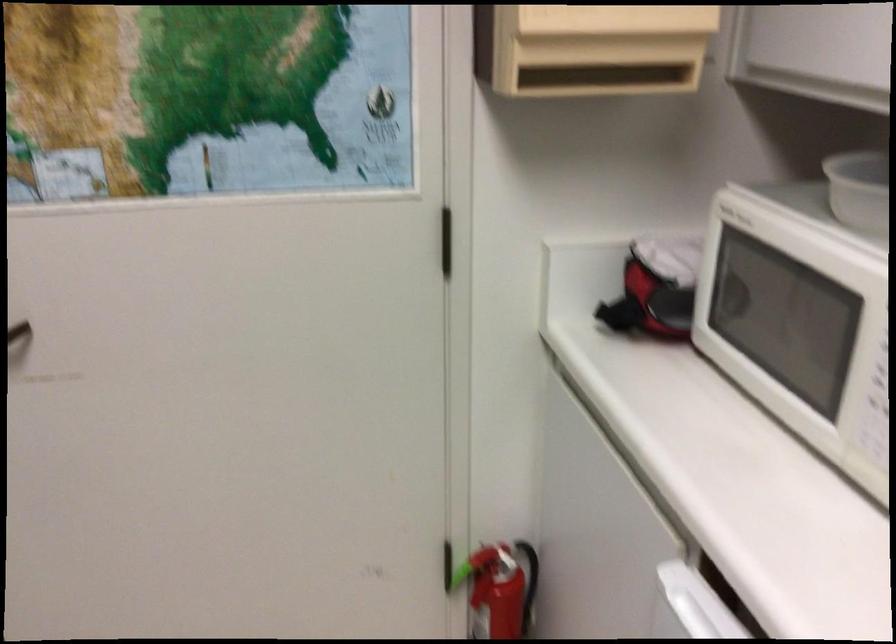
Where is `fire extinguisher handle`? Image resolution: width=896 pixels, height=644 pixels. fire extinguisher handle is located at coordinates (472, 570).